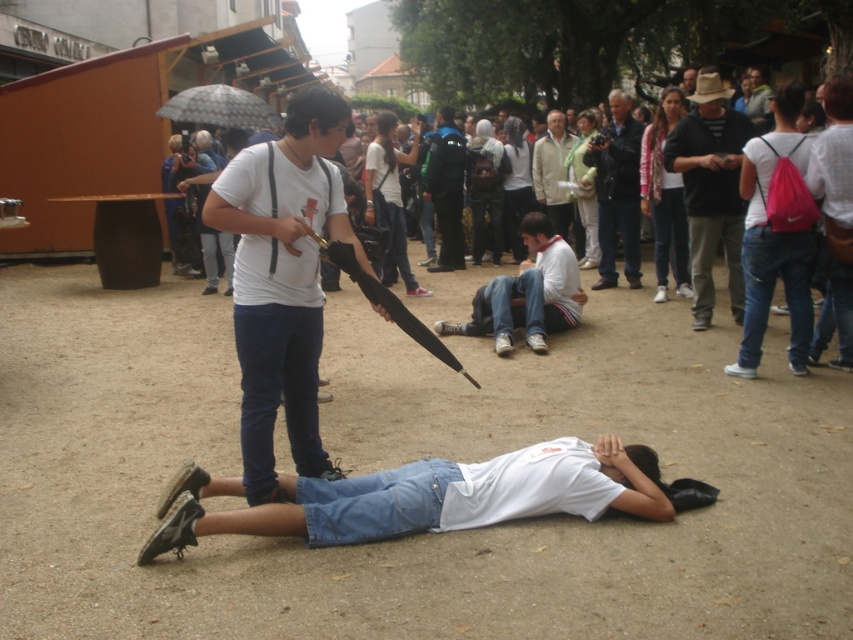
Consider the image. You are a photographer at the event and want to capture both the white cotton shirt at center and the light beige jacket at center in the same frame. Which object should you focus on first to ensure both are in the frame?

You should focus on the light beige jacket at center first because it is taller than the white cotton shirt at center, ensuring both are visible in the frame.

You are a photographer at the event and want to capture a clear photo of both the white cotton shirt at center and the blue fabric jacket at center. Which one should you focus on first to ensure both are in focus?

The white cotton shirt at center is in front of the blue fabric jacket at center, so you should focus on the white cotton shirt at center first to ensure both are in focus.